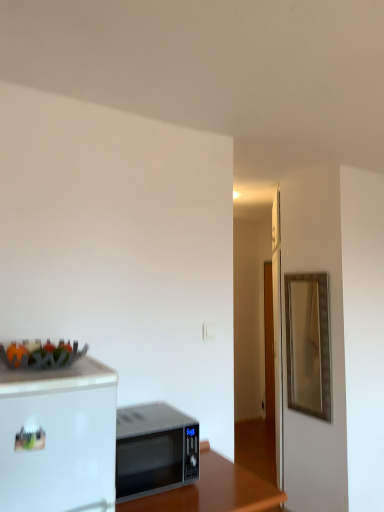
Question: Is gold metallic mirror at right taller than silver metallic microwave at center?

Choices:
 (A) yes
 (B) no

Answer: (A)

Question: Does gold metallic mirror at right appear on the left side of silver metallic microwave at center?

Choices:
 (A) yes
 (B) no

Answer: (B)

Question: From a real-world perspective, is gold metallic mirror at right physically below silver metallic microwave at center?

Choices:
 (A) no
 (B) yes

Answer: (A)

Question: Considering the relative sizes of gold metallic mirror at right and silver metallic microwave at center in the image provided, is gold metallic mirror at right thinner than silver metallic microwave at center?

Choices:
 (A) yes
 (B) no

Answer: (A)

Question: Considering the relative positions of gold metallic mirror at right and silver metallic microwave at center in the image provided, is gold metallic mirror at right to the right of silver metallic microwave at center from the viewer's perspective?

Choices:
 (A) yes
 (B) no

Answer: (A)

Question: Is metallic fruit basket at upper left wider or thinner than silver metallic microwave at center?

Choices:
 (A) thin
 (B) wide

Answer: (B)

Question: Is metallic fruit basket at upper left bigger or smaller than silver metallic microwave at center?

Choices:
 (A) small
 (B) big

Answer: (A)

Question: From the image's perspective, is metallic fruit basket at upper left above or below silver metallic microwave at center?

Choices:
 (A) below
 (B) above

Answer: (B)

Question: Is metallic fruit basket at upper left inside the boundaries of silver metallic microwave at center, or outside?

Choices:
 (A) inside
 (B) outside

Answer: (B)

Question: Is gold metallic mirror at right wider or thinner than black glossy microwave at lower center?

Choices:
 (A) thin
 (B) wide

Answer: (A)

Question: Based on their sizes in the image, would you say gold metallic mirror at right is bigger or smaller than black glossy microwave at lower center?

Choices:
 (A) big
 (B) small

Answer: (B)

Question: Is point (319, 407) positioned closer to the camera than point (241, 497)?

Choices:
 (A) closer
 (B) farther

Answer: (B)

Question: From a real-world perspective, is gold metallic mirror at right above or below black glossy microwave at lower center?

Choices:
 (A) below
 (B) above

Answer: (B)

Question: Is black glossy microwave at lower center inside or outside of silver metallic microwave at center?

Choices:
 (A) outside
 (B) inside

Answer: (A)

Question: Would you say black glossy microwave at lower center is to the left or to the right of silver metallic microwave at center in the picture?

Choices:
 (A) right
 (B) left

Answer: (A)